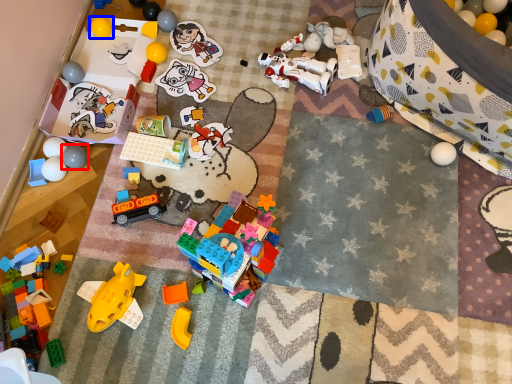
Question: Which of the following is the closest to the observer, toy (highlighted by a red box) or toy (highlighted by a blue box)?

Choices:
 (A) toy
 (B) toy

Answer: (A)